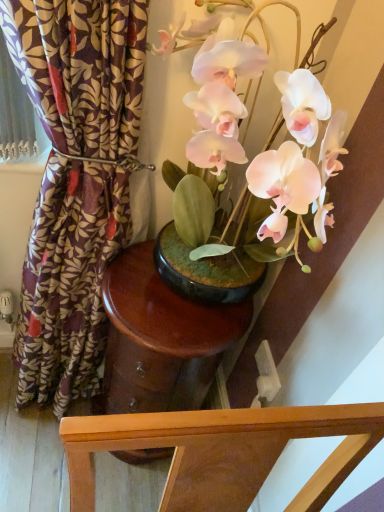
Question: Is glossy wood side table at center with purple floral fabric at left?

Choices:
 (A) yes
 (B) no

Answer: (B)

Question: From the image's perspective, is glossy wood side table at center located above purple floral fabric at left?

Choices:
 (A) yes
 (B) no

Answer: (B)

Question: Can you confirm if glossy wood side table at center is taller than purple floral fabric at left?

Choices:
 (A) yes
 (B) no

Answer: (B)

Question: Is glossy wood side table at center wider than purple floral fabric at left?

Choices:
 (A) no
 (B) yes

Answer: (B)

Question: Is glossy wood side table at center aimed at purple floral fabric at left?

Choices:
 (A) no
 (B) yes

Answer: (A)

Question: From a real-world perspective, is purple floral fabric at left above or below glossy wood side table at center?

Choices:
 (A) above
 (B) below

Answer: (A)

Question: Is purple floral fabric at left inside the boundaries of glossy wood side table at center, or outside?

Choices:
 (A) outside
 (B) inside

Answer: (A)

Question: Is purple floral fabric at left to the left or to the right of glossy wood side table at center in the image?

Choices:
 (A) right
 (B) left

Answer: (B)

Question: Is purple floral fabric at left taller or shorter than glossy wood side table at center?

Choices:
 (A) tall
 (B) short

Answer: (A)

Question: From a real-world perspective, relative to purple floral fabric at left, is white plastic power outlet at lower right vertically above or below?

Choices:
 (A) above
 (B) below

Answer: (B)

Question: Is white plastic power outlet at lower right bigger or smaller than purple floral fabric at left?

Choices:
 (A) big
 (B) small

Answer: (B)

Question: From the image's perspective, is white plastic power outlet at lower right positioned above or below purple floral fabric at left?

Choices:
 (A) below
 (B) above

Answer: (A)

Question: In the image, is white plastic power outlet at lower right positioned in front of or behind purple floral fabric at left?

Choices:
 (A) behind
 (B) front

Answer: (A)

Question: Do you think matte pink orchid at center is within purple floral fabric at left, or outside of it?

Choices:
 (A) inside
 (B) outside

Answer: (B)

Question: Considering the relative positions of matte pink orchid at center and purple floral fabric at left in the image provided, is matte pink orchid at center to the left or to the right of purple floral fabric at left?

Choices:
 (A) right
 (B) left

Answer: (A)